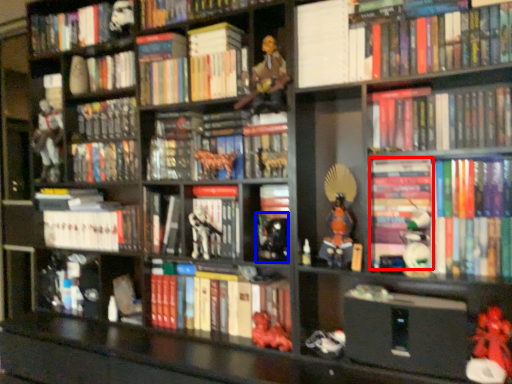
Question: Which of the following is the closest to the observer, book (highlighted by a red box) or toy (highlighted by a blue box)?

Choices:
 (A) book
 (B) toy

Answer: (A)